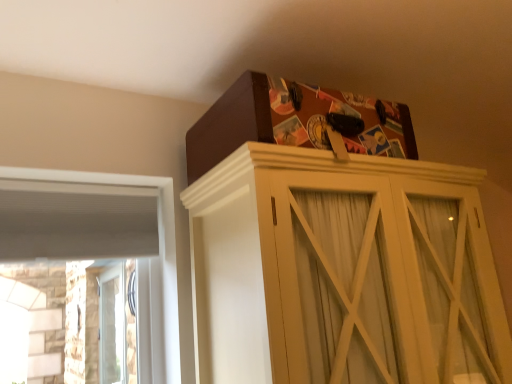
Question: From a real-world perspective, is white wood frame at left positioned above or below matte brown cabinet at upper center?

Choices:
 (A) above
 (B) below

Answer: (A)

Question: Looking at the image, does white wood frame at left seem bigger or smaller compared to matte brown cabinet at upper center?

Choices:
 (A) small
 (B) big

Answer: (A)

Question: Which is nearer to the white wood frame at left?

Choices:
 (A) matte brown cabinet at upper center
 (B) brown cardboard box at upper center

Answer: (B)

Question: Estimate the real-world distances between objects in this image. Which object is closer to the white wood frame at left?

Choices:
 (A) matte brown cabinet at upper center
 (B) brown cardboard box at upper center

Answer: (B)